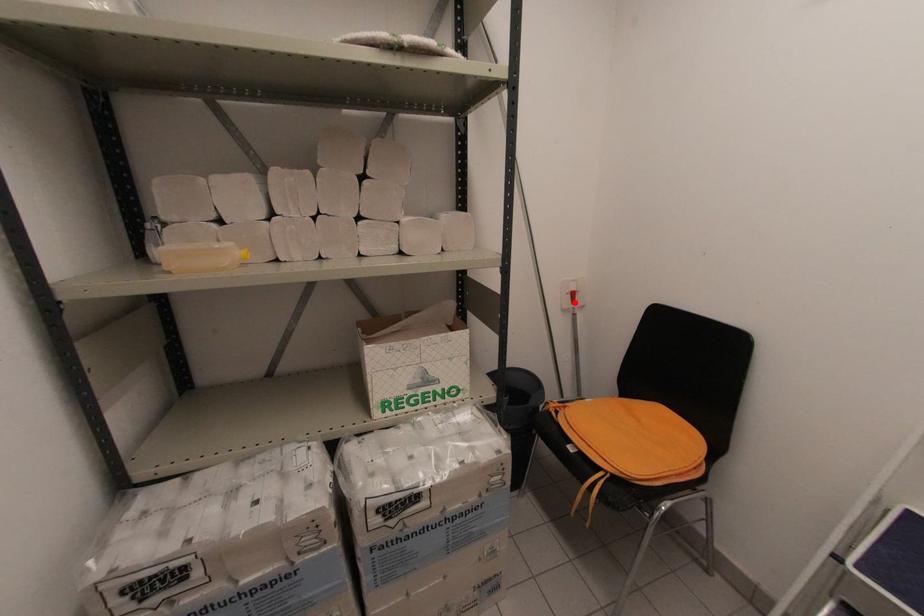
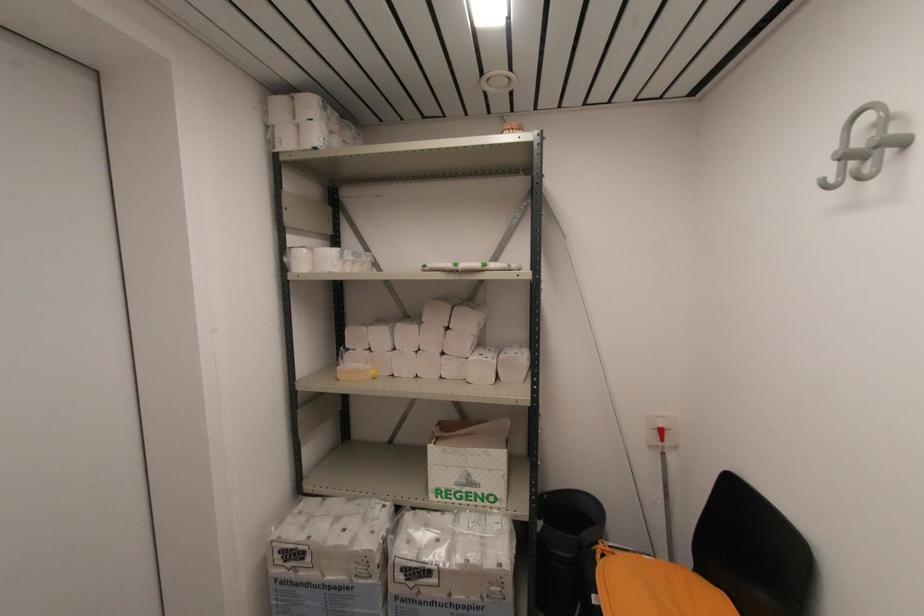
In the second image, find the point that corresponds to the highlighted location in the first image.

(663, 439)